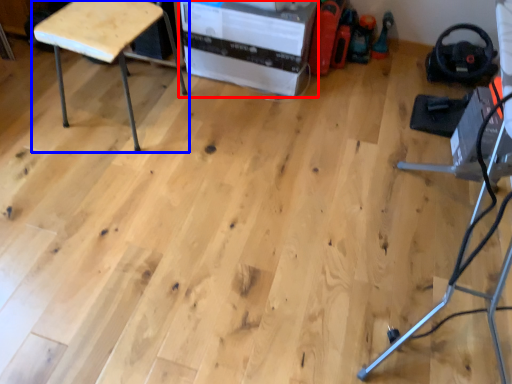
Question: Which object is further to the camera taking this photo, cardboard box (highlighted by a red box) or furniture (highlighted by a blue box)?

Choices:
 (A) cardboard box
 (B) furniture

Answer: (A)